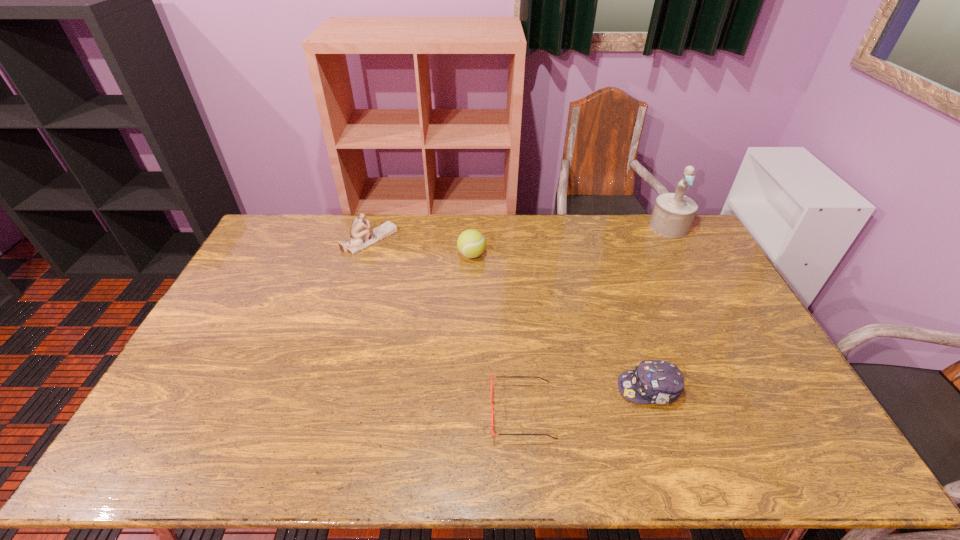
At what (x,y) coordinates should I click in order to perform the action: click on vacant space at the near right corner. Please return your answer as a coordinate pair (x, y). The width and height of the screenshot is (960, 540). Looking at the image, I should click on (821, 446).

The height and width of the screenshot is (540, 960). I want to click on vacant region between the third object from right to left and the second shortest object, so click(x=586, y=400).

Locate an element on the screen. vacant area that lies between the tennis ball and the shortest object is located at coordinates (497, 333).

The width and height of the screenshot is (960, 540). Identify the location of free space between the tallest object and the shortest object. (595, 319).

Where is `vacant space that is in between the third object from left to right and the tallest object`? Image resolution: width=960 pixels, height=540 pixels. vacant space that is in between the third object from left to right and the tallest object is located at coordinates (595, 319).

The height and width of the screenshot is (540, 960). Find the location of `empty space that is in between the third tallest object and the tallest object`. empty space that is in between the third tallest object and the tallest object is located at coordinates [570, 241].

You are a GUI agent. You are given a task and a screenshot of the screen. Output one action in this format:
    pyautogui.click(x=<x>, y=<y>)
    Task: Click on the free spot between the right figurine and the spectacles
    This screenshot has width=960, height=540.
    Given the screenshot: What is the action you would take?
    pyautogui.click(x=595, y=319)

I want to click on free space between the tennis ball and the spectacles, so click(497, 333).

Locate an element on the screen. free space between the second shortest object and the spectacles is located at coordinates (586, 400).

Image resolution: width=960 pixels, height=540 pixels. I want to click on free point between the shortest object and the taller figurine, so click(595, 319).